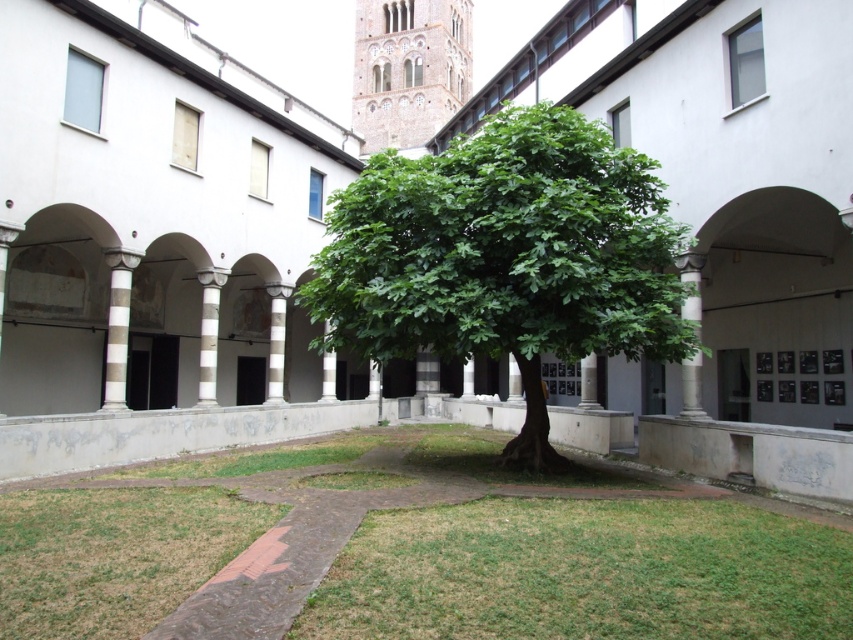
Question: Which of the following is the closest to the observer?

Choices:
 (A) white striped column at center
 (B) white marble pillar at center
 (C) white striped pillar at center
 (D) light beige stone tower at upper center

Answer: (B)

Question: Which point is farther to the camera?

Choices:
 (A) (480, 140)
 (B) (271, 300)
 (C) (693, 316)

Answer: (B)

Question: Which of the following is the closest to the observer?

Choices:
 (A) white striped column at center
 (B) light beige stone tower at upper center

Answer: (A)

Question: Is white marble pillar at center-right thinner than white striped pillar at center?

Choices:
 (A) no
 (B) yes

Answer: (A)

Question: Is green leafy tree at center to the right of light beige stone tower at upper center from the viewer's perspective?

Choices:
 (A) yes
 (B) no

Answer: (A)

Question: Is light beige stone tower at upper center above white marble pillar at center?

Choices:
 (A) no
 (B) yes

Answer: (B)